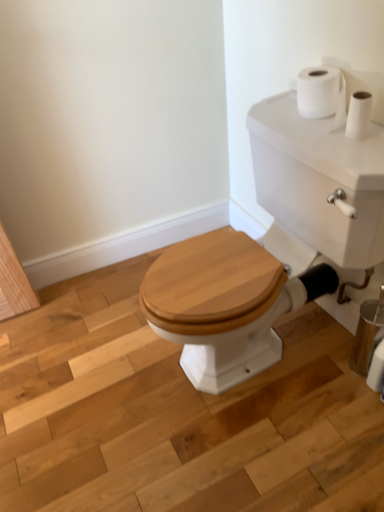
Question: Can you confirm if white glossy porcelain at center is wider than white matte toilet paper at upper right, the first toilet paper when ordered from bottom to top?

Choices:
 (A) no
 (B) yes

Answer: (B)

Question: Does white glossy porcelain at center appear on the left side of white matte toilet paper at upper right, which is the second toilet paper in top-to-bottom order?

Choices:
 (A) no
 (B) yes

Answer: (B)

Question: Considering the relative sizes of white glossy porcelain at center and white matte toilet paper at upper right, the 1th toilet paper when ordered from right to left, in the image provided, is white glossy porcelain at center shorter than white matte toilet paper at upper right, the 1th toilet paper when ordered from right to left,?

Choices:
 (A) no
 (B) yes

Answer: (A)

Question: Does white glossy porcelain at center have a lesser width compared to white matte toilet paper at upper right, which is the second toilet paper in top-to-bottom order?

Choices:
 (A) yes
 (B) no

Answer: (B)

Question: Is white glossy porcelain at center in front of white matte toilet paper at upper right, the first toilet paper when ordered from bottom to top?

Choices:
 (A) yes
 (B) no

Answer: (A)

Question: Considering the relative positions of white matte toilet paper at upper right, the second toilet paper in the bottom-to-top sequence, and white glossy porcelain at center in the image provided, is white matte toilet paper at upper right, the second toilet paper in the bottom-to-top sequence, to the left or to the right of white glossy porcelain at center?

Choices:
 (A) right
 (B) left

Answer: (A)

Question: Is white matte toilet paper at upper right, acting as the second toilet paper starting from the right, taller or shorter than white glossy porcelain at center?

Choices:
 (A) tall
 (B) short

Answer: (B)

Question: Looking at their shapes, would you say white matte toilet paper at upper right, the first toilet paper positioned from the left, is wider or thinner than white glossy porcelain at center?

Choices:
 (A) thin
 (B) wide

Answer: (A)

Question: Is white matte toilet paper at upper right, acting as the second toilet paper starting from the right, in front of or behind white glossy porcelain at center in the image?

Choices:
 (A) front
 (B) behind

Answer: (B)

Question: Is white glossy porcelain at center inside the boundaries of white matte toilet paper at upper right, the first toilet paper positioned from the left, or outside?

Choices:
 (A) outside
 (B) inside

Answer: (A)

Question: In the image, is white glossy porcelain at center positioned in front of or behind white matte toilet paper at upper right, the second toilet paper in the bottom-to-top sequence?

Choices:
 (A) behind
 (B) front

Answer: (B)

Question: Considering the positions of white glossy porcelain at center and white matte toilet paper at upper right, the second toilet paper in the bottom-to-top sequence, in the image, is white glossy porcelain at center wider or thinner than white matte toilet paper at upper right, the second toilet paper in the bottom-to-top sequence,?

Choices:
 (A) thin
 (B) wide

Answer: (B)

Question: From the image's perspective, is white glossy porcelain at center located above or below white matte toilet paper at upper right, the first toilet paper positioned from the left?

Choices:
 (A) below
 (B) above

Answer: (A)

Question: From a real-world perspective, is wooden toilet seat at center positioned above or below white matte toilet paper at upper right, the first toilet paper positioned from the left?

Choices:
 (A) below
 (B) above

Answer: (A)

Question: Based on their positions, is wooden toilet seat at center located to the left or right of white matte toilet paper at upper right, arranged as the first toilet paper when viewed from the top?

Choices:
 (A) right
 (B) left

Answer: (B)